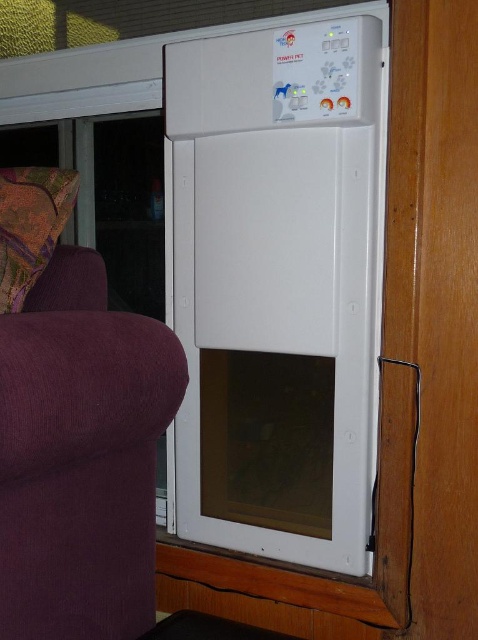
You are a person sitting on the purple fabric couch at left and want to reach the multicolored fabric pillow at left. Is the pillow within easy arm reach from your current position?

The purple fabric couch at left is closer to the viewer than multicolored fabric pillow at left, so the pillow is farther away. It may not be within easy arm reach from the couch.

Consider the image. You are a pet owner who wants to place a new pet bed between the purple fabric couch at left and the multicolored fabric pillow at left. Based on their positions, which object should the bed be closer to?

The purple fabric couch at left is positioned under the multicolored fabric pillow at left, so the bed should be placed closer to the purple fabric couch at left to avoid blocking the pillow.

You are a cat owner who wants to ensure your pet can access the white plastic pet door at center from the purple fabric couch at left. Based on their positions, can your cat easily reach the pet door from the couch?

The white plastic pet door at center is to the right of the purple fabric couch at left, so the cat can easily reach it by moving to the right from the couch.